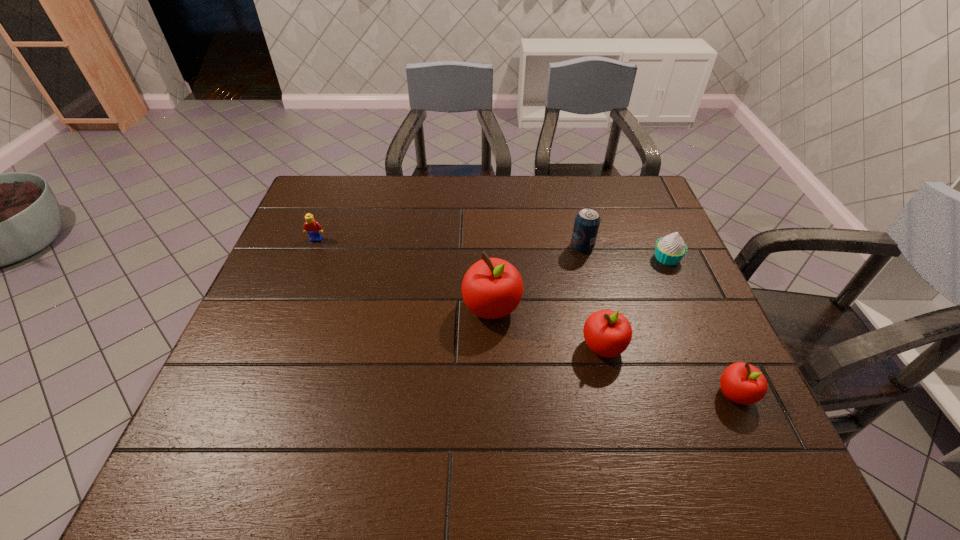
This screenshot has height=540, width=960. What are the coordinates of `vacant position in the image that satisfies the following two spatial constraints: 1. on the front-facing side of the Lego; 2. on the right side of the nearest object` in the screenshot? It's located at (254, 394).

The height and width of the screenshot is (540, 960). In order to click on vacant point that satisfies the following two spatial constraints: 1. on the front side of the cupcake; 2. on the left side of the pop soda in this screenshot , I will do `click(586, 258)`.

You are a GUI agent. You are given a task and a screenshot of the screen. Output one action in this format:
    pyautogui.click(x=<x>, y=<y>)
    Task: Click on the free space that satisfies the following two spatial constraints: 1. on the front-facing side of the Lego; 2. on the right side of the pop soda
    The height and width of the screenshot is (540, 960).
    Given the screenshot: What is the action you would take?
    pyautogui.click(x=314, y=246)

Identify the location of free region that satisfies the following two spatial constraints: 1. on the front side of the cupcake; 2. on the right side of the pop soda. (586, 258).

Find the location of a particular element. The height and width of the screenshot is (540, 960). vacant space that satisfies the following two spatial constraints: 1. on the front-facing side of the leftmost object; 2. on the right side of the second shortest apple is located at coordinates (273, 347).

This screenshot has width=960, height=540. What are the coordinates of `vacant space that satisfies the following two spatial constraints: 1. on the front-facing side of the leftmost object; 2. on the right side of the cupcake` in the screenshot? It's located at (309, 258).